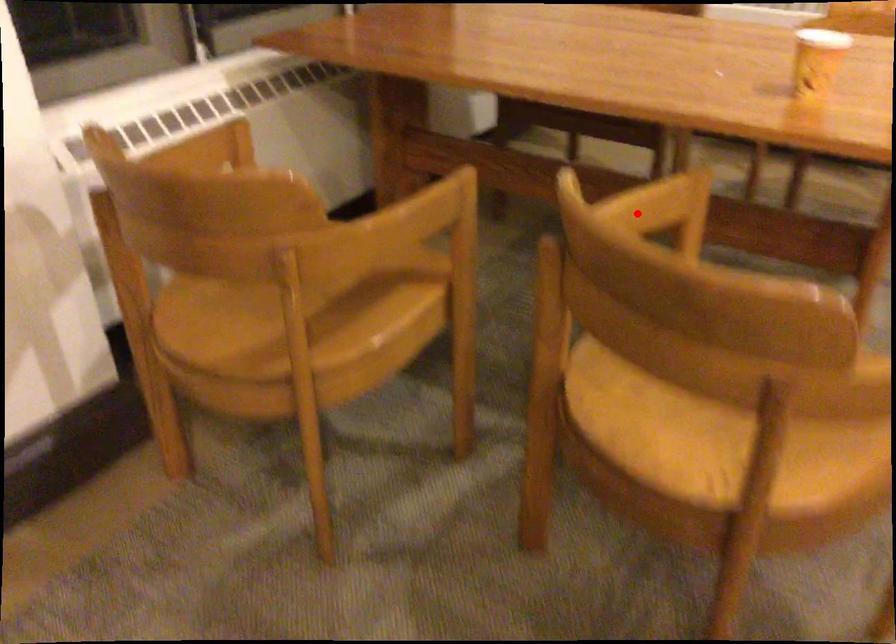
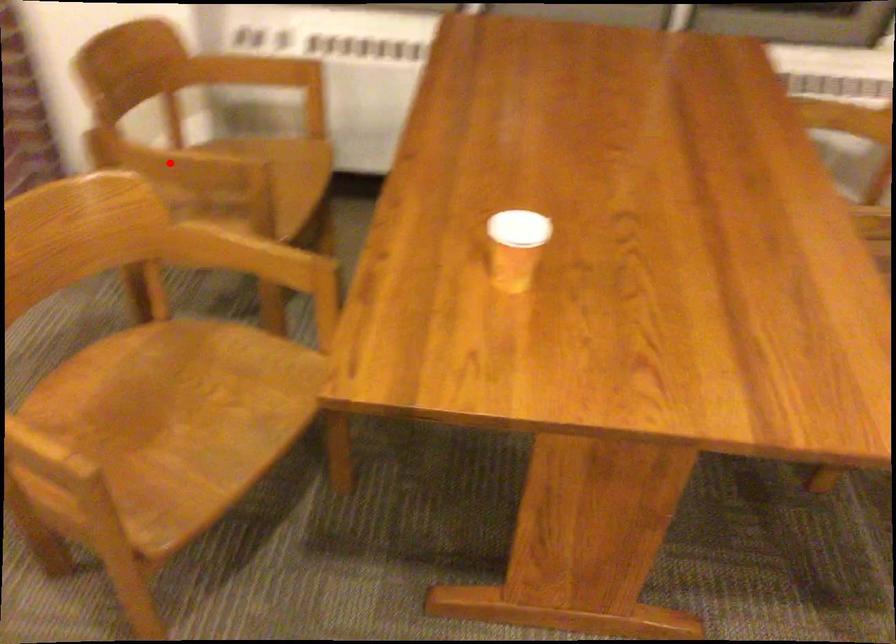
I am providing you with two images of the same scene from different viewpoints. A red point is marked on the first image and another point is marked on the second image. Do the highlighted points in image1 and image2 indicate the same real-world spot?

No